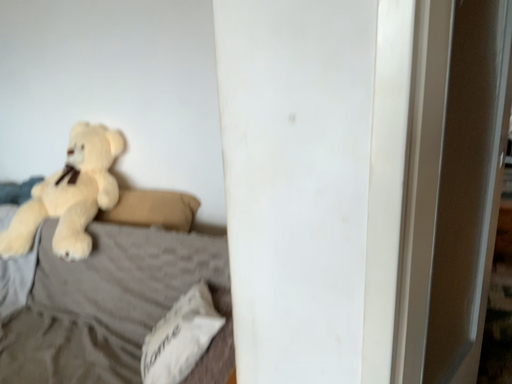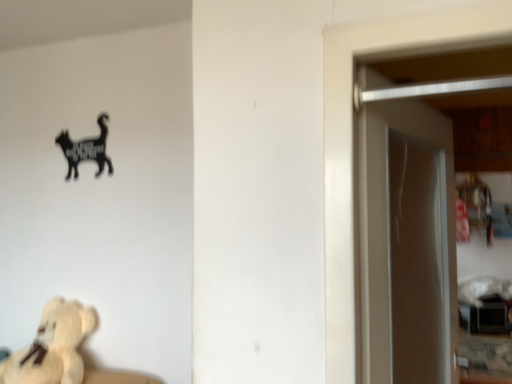
Question: How did the camera likely rotate when shooting the video?

Choices:
 (A) rotated downward
 (B) rotated upward

Answer: (B)